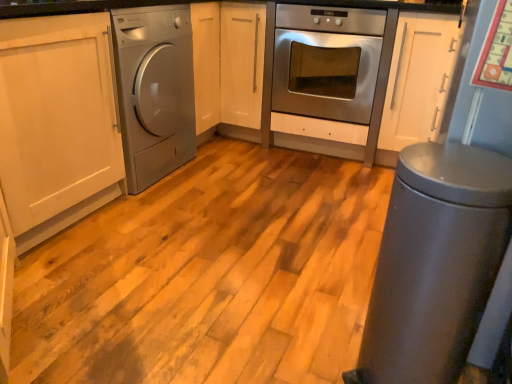
Where is `vacant area on the back side of metallic gray trash can at lower right`? This screenshot has height=384, width=512. vacant area on the back side of metallic gray trash can at lower right is located at coordinates (337, 316).